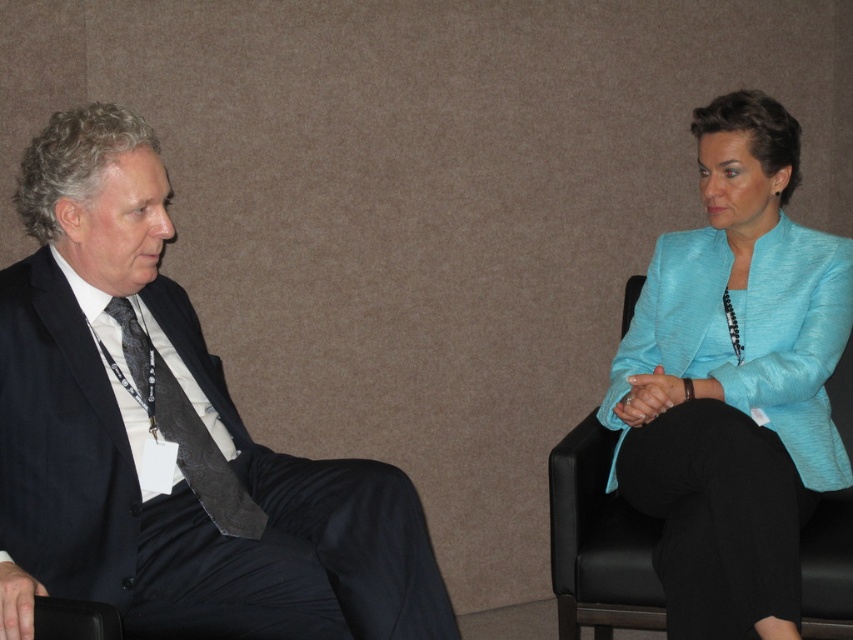
Question: Does turquoise fabric jacket at right come behind dark gray textured tie at left?

Choices:
 (A) yes
 (B) no

Answer: (A)

Question: Is dark blue suit at left thinner than turquoise fabric jacket at right?

Choices:
 (A) yes
 (B) no

Answer: (B)

Question: Which of the following is the farthest from the observer?

Choices:
 (A) dark blue suit at left
 (B) dark gray textured tie at left
 (C) turquoise fabric jacket at right

Answer: (C)

Question: Which of the following is the farthest from the observer?

Choices:
 (A) [x=195, y=602]
 (B) [x=254, y=531]
 (C) [x=703, y=524]

Answer: (C)

Question: From the image, what is the correct spatial relationship of dark blue suit at left in relation to dark gray textured tie at left?

Choices:
 (A) left
 (B) right

Answer: (A)

Question: Which point appears closest to the camera in this image?

Choices:
 (A) (44, 444)
 (B) (239, 486)

Answer: (A)